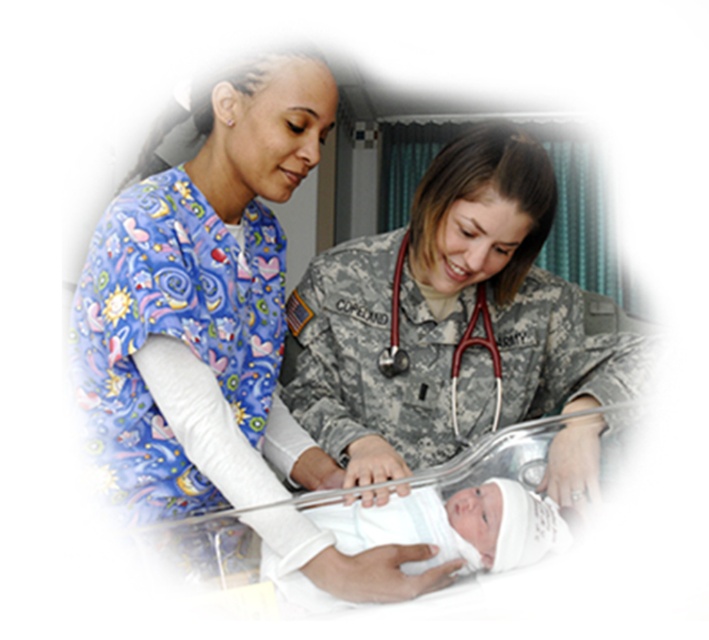
Can you confirm if camouflage uniform at center is positioned to the left of printed cotton scrub top at left?

In fact, camouflage uniform at center is to the right of printed cotton scrub top at left.

Is camouflage uniform at center behind printed cotton scrub top at left?

Yes, camouflage uniform at center is behind printed cotton scrub top at left.

Between point (418, 394) and point (245, 346), which one is positioned in front?

Positioned in front is point (245, 346).

In order to click on camouflage uniform at center in this screenshot , I will do `click(447, 317)`.

Is printed cotton scrub top at left above red rubber stethoscope at center?

Incorrect, printed cotton scrub top at left is not positioned above red rubber stethoscope at center.

Is printed cotton scrub top at left closer to camera compared to red rubber stethoscope at center?

Yes, printed cotton scrub top at left is closer to the viewer.

The image size is (709, 640). Find the location of `printed cotton scrub top at left`. printed cotton scrub top at left is located at coordinates (182, 353).

Is camouflage uniform at center positioned behind red rubber stethoscope at center?

No, it is in front of red rubber stethoscope at center.

Does point (401, 241) come behind point (393, 362)?

Yes, point (401, 241) is behind point (393, 362).

Between point (537, 228) and point (484, 289), which one is positioned behind?

Positioned behind is point (484, 289).

The width and height of the screenshot is (709, 640). I want to click on camouflage uniform at center, so click(x=447, y=317).